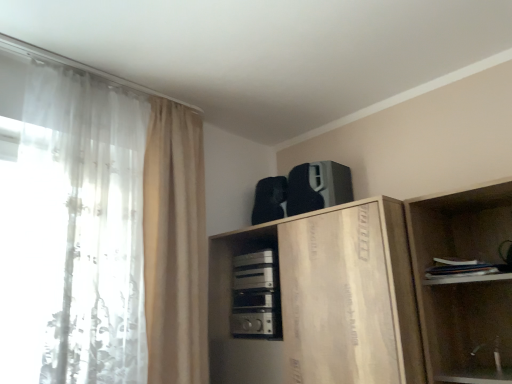
Question: Does satin silver appliance at center, positioned as the 1th appliance in bottom-to-top order, come behind black matte speaker at upper center, marked as the second appliance in a bottom-to-top arrangement?

Choices:
 (A) no
 (B) yes

Answer: (A)

Question: Is satin silver appliance at center, the 2th appliance from the top, not close to black matte speaker at upper center, marked as the second appliance in a bottom-to-top arrangement?

Choices:
 (A) yes
 (B) no

Answer: (B)

Question: Is black matte speaker at upper center, marked as the second appliance in a bottom-to-top arrangement, inside satin silver appliance at center, positioned as the 1th appliance in bottom-to-top order?

Choices:
 (A) no
 (B) yes

Answer: (A)

Question: Is the position of satin silver appliance at center, the 2th appliance from the top, less distant than that of black matte speaker at upper center, marked as the second appliance in a bottom-to-top arrangement?

Choices:
 (A) yes
 (B) no

Answer: (A)

Question: Considering the relative sizes of satin silver appliance at center, the 2th appliance from the top, and black matte speaker at upper center, marked as the second appliance in a bottom-to-top arrangement, in the image provided, is satin silver appliance at center, the 2th appliance from the top, shorter than black matte speaker at upper center, marked as the second appliance in a bottom-to-top arrangement,?

Choices:
 (A) no
 (B) yes

Answer: (A)

Question: From their relative heights in the image, would you say beige fabric curtain at left, which is counted as the 1th curtain, starting from the right, is taller or shorter than black matte speaker at upper center, positioned as the first appliance in top-to-bottom order?

Choices:
 (A) tall
 (B) short

Answer: (A)

Question: Considering their positions, is beige fabric curtain at left, which ranks as the second curtain in left-to-right order, located in front of or behind black matte speaker at upper center, positioned as the first appliance in top-to-bottom order?

Choices:
 (A) front
 (B) behind

Answer: (A)

Question: Considering the positions of beige fabric curtain at left, which is counted as the 1th curtain, starting from the right, and black matte speaker at upper center, positioned as the first appliance in top-to-bottom order, in the image, is beige fabric curtain at left, which is counted as the 1th curtain, starting from the right, bigger or smaller than black matte speaker at upper center, positioned as the first appliance in top-to-bottom order,?

Choices:
 (A) small
 (B) big

Answer: (B)

Question: From a real-world perspective, is beige fabric curtain at left, which is counted as the 1th curtain, starting from the right, physically located above or below black matte speaker at upper center, marked as the second appliance in a bottom-to-top arrangement?

Choices:
 (A) above
 (B) below

Answer: (B)

Question: From the image's perspective, is black matte speaker at upper center, marked as the second appliance in a bottom-to-top arrangement, located above or below white sheer curtain at left, acting as the second curtain starting from the right?

Choices:
 (A) below
 (B) above

Answer: (B)

Question: Looking at their shapes, would you say black matte speaker at upper center, marked as the second appliance in a bottom-to-top arrangement, is wider or thinner than white sheer curtain at left, acting as the second curtain starting from the right?

Choices:
 (A) thin
 (B) wide

Answer: (B)

Question: Considering the positions of black matte speaker at upper center, marked as the second appliance in a bottom-to-top arrangement, and white sheer curtain at left, which appears as the first curtain when viewed from the left, in the image, is black matte speaker at upper center, marked as the second appliance in a bottom-to-top arrangement, taller or shorter than white sheer curtain at left, which appears as the first curtain when viewed from the left,?

Choices:
 (A) short
 (B) tall

Answer: (A)

Question: Looking at the image, does black matte speaker at upper center, positioned as the first appliance in top-to-bottom order, seem bigger or smaller compared to white sheer curtain at left, acting as the second curtain starting from the right?

Choices:
 (A) small
 (B) big

Answer: (A)

Question: Considering the positions of point (145, 168) and point (268, 362), is point (145, 168) closer or farther from the camera than point (268, 362)?

Choices:
 (A) closer
 (B) farther

Answer: (B)

Question: Relative to wooden cabinet at upper center, is white sheer curtain at left, acting as the second curtain starting from the right, in front or behind?

Choices:
 (A) front
 (B) behind

Answer: (A)